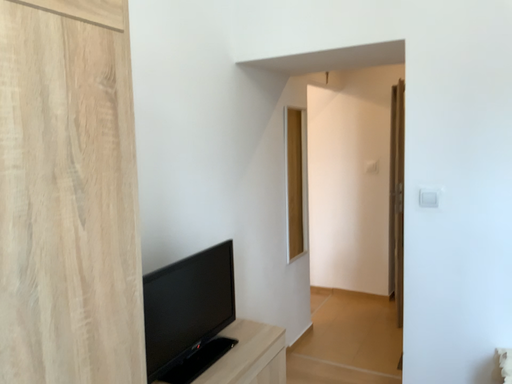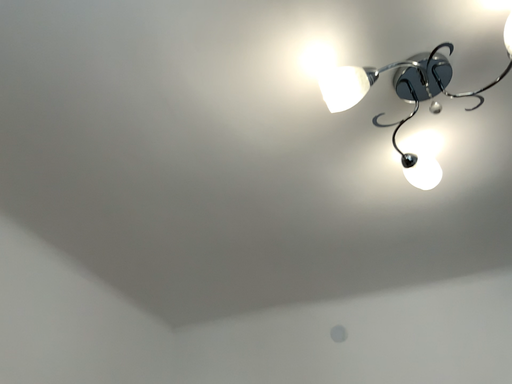
Question: Which way did the camera rotate in the video?

Choices:
 (A) rotated left
 (B) rotated right

Answer: (B)